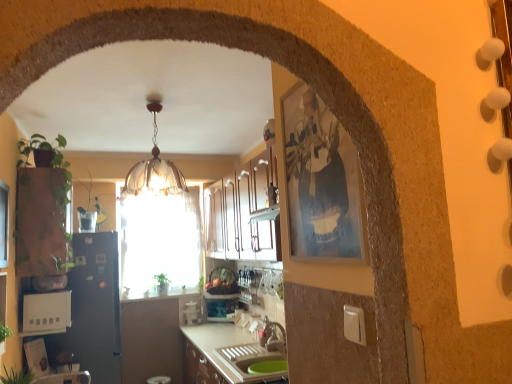
You are a GUI agent. You are given a task and a screenshot of the screen. Output one action in this format:
    pyautogui.click(x=<x>, y=<y>)
    Task: Click on the free space above white glossy counter top at center (from a real-world perspective)
    The image size is (512, 384).
    Given the screenshot: What is the action you would take?
    pyautogui.click(x=163, y=294)